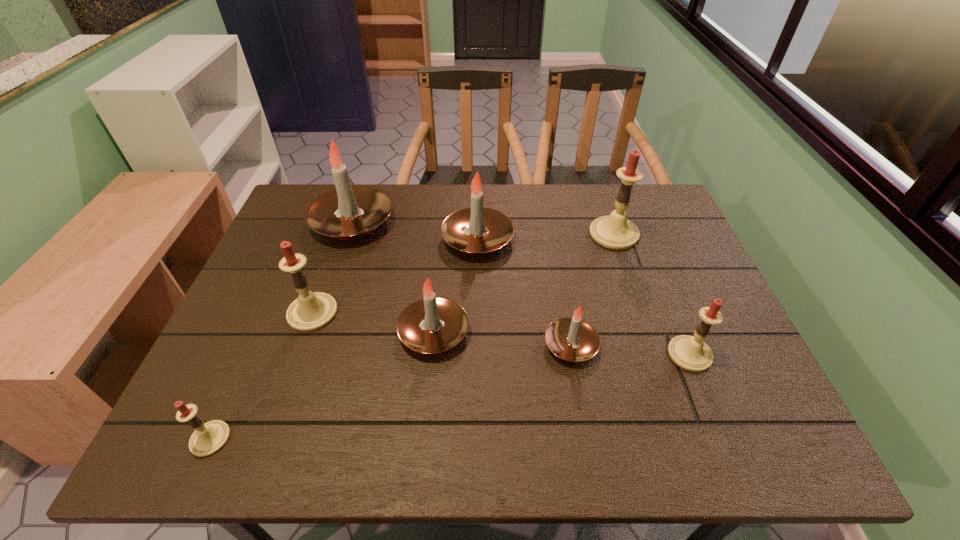
Select which white candle appears as the third closest to the rightmost white candle. Please provide its 2D coordinates. Your answer should be formatted as a tuple, i.e. [(x, y)], where the tuple contains the x and y coordinates of a point satisfying the conditions above.

[(349, 212)]

Identify which white candle is the third nearest to the third smallest white candle. Please provide its 2D coordinates. Your answer should be formatted as a tuple, i.e. [(x, y)], where the tuple contains the x and y coordinates of a point satisfying the conditions above.

[(572, 339)]

The height and width of the screenshot is (540, 960). What are the coordinates of `the second closest red candle relative to the second smallest white candle` in the screenshot? It's located at (208, 438).

You are a GUI agent. You are given a task and a screenshot of the screen. Output one action in this format:
    pyautogui.click(x=<x>, y=<y>)
    Task: Click on the fourth closest red candle relative to the sixth candle from left to right
    The width and height of the screenshot is (960, 540).
    Given the screenshot: What is the action you would take?
    pyautogui.click(x=208, y=438)

Image resolution: width=960 pixels, height=540 pixels. What are the coordinates of `free space that satisfies the following two spatial constraints: 1. on the back side of the nearest candle; 2. on the left side of the biggest white candle` in the screenshot? It's located at (307, 222).